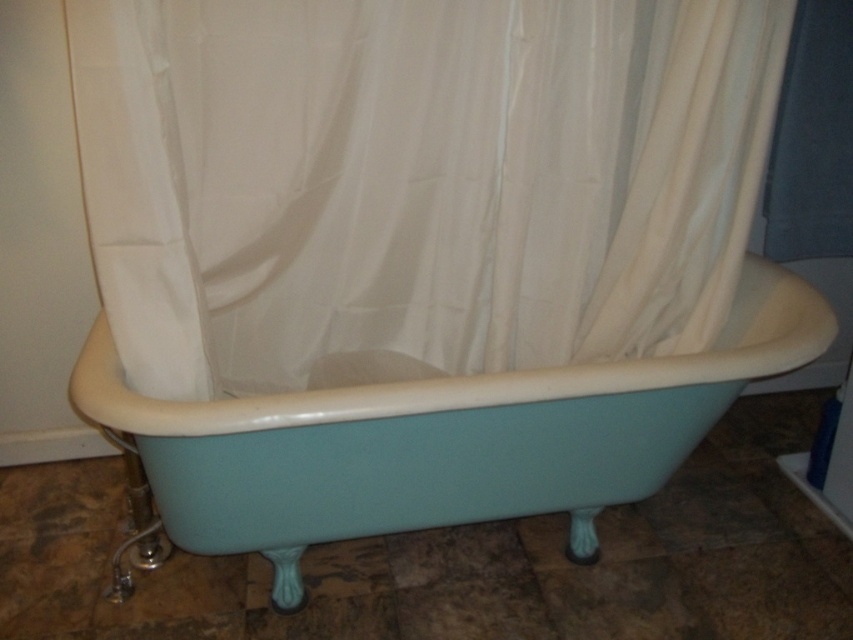
Is white fabric shower curtain at center bigger than teal glossy bathtub at center?

Actually, white fabric shower curtain at center might be smaller than teal glossy bathtub at center.

Can you confirm if white fabric shower curtain at center is taller than teal glossy bathtub at center?

Indeed, white fabric shower curtain at center has a greater height compared to teal glossy bathtub at center.

Does point (96, 138) lie in front of point (288, 396)?

Yes, it is.

You are a GUI agent. You are given a task and a screenshot of the screen. Output one action in this format:
    pyautogui.click(x=<x>, y=<y>)
    Task: Click on the white fabric shower curtain at center
    This screenshot has width=853, height=640.
    Given the screenshot: What is the action you would take?
    [x=416, y=179]